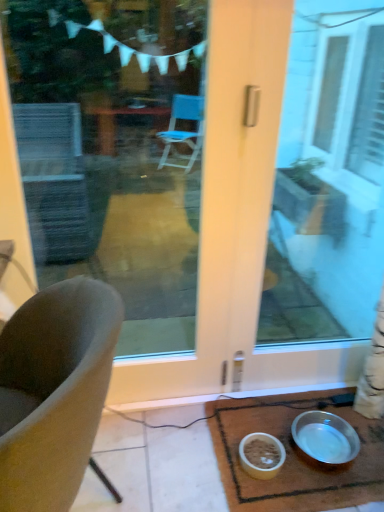
The height and width of the screenshot is (512, 384). What are the coordinates of `metallic silver bowl at lower right` in the screenshot? It's located at (293, 457).

What do you see at coordinates (293, 457) in the screenshot? I see `metallic silver bowl at lower right` at bounding box center [293, 457].

What is the approximate height of transparent glass door at center, positioned as the 2th window screen in right-to-left order?

transparent glass door at center, positioned as the 2th window screen in right-to-left order, is 1.35 meters tall.

Where is `transparent glass door at center, positioned as the 2th window screen in right-to-left order`? This screenshot has height=512, width=384. transparent glass door at center, positioned as the 2th window screen in right-to-left order is located at coordinates (112, 151).

Locate an element on the screen. The width and height of the screenshot is (384, 512). transparent glass door at center, placed as the second window screen when sorted from left to right is located at coordinates (328, 182).

From the image's perspective, is transparent glass door at center, which is the 1th window screen in right-to-left order, over matte brown bowl at lower center, acting as the first bowl starting from the left?

Yes, from the image's perspective, transparent glass door at center, which is the 1th window screen in right-to-left order, is over matte brown bowl at lower center, acting as the first bowl starting from the left.

How many degrees apart are the facing directions of transparent glass door at center, placed as the second window screen when sorted from left to right, and matte brown bowl at lower center, arranged as the second bowl when viewed from the right?

The angular difference between transparent glass door at center, placed as the second window screen when sorted from left to right, and matte brown bowl at lower center, arranged as the second bowl when viewed from the right, is 0.827 degrees.

Between transparent glass door at center, which is the 1th window screen in right-to-left order, and matte brown bowl at lower center, acting as the first bowl starting from the left, which one is positioned behind?

matte brown bowl at lower center, acting as the first bowl starting from the left.

Is transparent glass door at center, placed as the second window screen when sorted from left to right, turned away from matte brown bowl at lower center, acting as the first bowl starting from the left?

That's not correct — transparent glass door at center, placed as the second window screen when sorted from left to right, is not looking away from matte brown bowl at lower center, acting as the first bowl starting from the left.

How many degrees apart are the facing directions of transparent glass door at center, positioned as the 2th window screen in right-to-left order, and matte brown bowl at lower center, acting as the first bowl starting from the left?

0.0906 degrees.

Is transparent glass door at center, positioned as the 2th window screen in right-to-left order, inside or outside of matte brown bowl at lower center, arranged as the second bowl when viewed from the right?

transparent glass door at center, positioned as the 2th window screen in right-to-left order, is not enclosed by matte brown bowl at lower center, arranged as the second bowl when viewed from the right.

From a real-world perspective, is transparent glass door at center, the first window screen positioned from the left, located beneath matte brown bowl at lower center, acting as the first bowl starting from the left?

Result: No, from a real-world perspective, transparent glass door at center, the first window screen positioned from the left, is not under matte brown bowl at lower center, acting as the first bowl starting from the left.

Based on their sizes in the image, would you say soft gray cushion at left is bigger or smaller than silver metallic bowl at lower right, the 2th bowl in the left-to-right sequence?

Clearly, soft gray cushion at left is larger in size than silver metallic bowl at lower right, the 2th bowl in the left-to-right sequence.

Considering their positions, is soft gray cushion at left located in front of or behind silver metallic bowl at lower right, the 2th bowl in the left-to-right sequence?

Visually, soft gray cushion at left is located in front of silver metallic bowl at lower right, the 2th bowl in the left-to-right sequence.

From the image's perspective, which one is positioned lower, soft gray cushion at left or silver metallic bowl at lower right, arranged as the 1th bowl when viewed from the right?

silver metallic bowl at lower right, arranged as the 1th bowl when viewed from the right, appears lower in the image.

From a real-world perspective, who is located higher, soft gray cushion at left or silver metallic bowl at lower right, the 2th bowl in the left-to-right sequence?

soft gray cushion at left is physically above.

Is metallic silver bowl at lower right shorter than soft gray cushion at left?

Correct, metallic silver bowl at lower right is not as tall as soft gray cushion at left.

From the picture: Which object is positioned more to the right, metallic silver bowl at lower right or soft gray cushion at left?

metallic silver bowl at lower right.

Does metallic silver bowl at lower right contain soft gray cushion at left?

No, metallic silver bowl at lower right does not contain soft gray cushion at left.

From a real-world perspective, who is located higher, matte brown bowl at lower center, acting as the first bowl starting from the left, or transparent glass door at center, placed as the second window screen when sorted from left to right?

In real-world perspective, transparent glass door at center, placed as the second window screen when sorted from left to right, is above.

Is matte brown bowl at lower center, acting as the first bowl starting from the left, taller than transparent glass door at center, placed as the second window screen when sorted from left to right?

No, matte brown bowl at lower center, acting as the first bowl starting from the left, is not taller than transparent glass door at center, placed as the second window screen when sorted from left to right.

Is matte brown bowl at lower center, arranged as the second bowl when viewed from the right, facing away from transparent glass door at center, placed as the second window screen when sorted from left to right?

No.

Between point (277, 442) and point (366, 75), which one is positioned in front?

The point (277, 442) is closer.

From the image's perspective, relative to transparent glass door at center, which is the 1th window screen in right-to-left order, is metallic silver bowl at lower right above or below?

Clearly, from the image's perspective, metallic silver bowl at lower right is below transparent glass door at center, which is the 1th window screen in right-to-left order.

Is transparent glass door at center, which is the 1th window screen in right-to-left order, a part of metallic silver bowl at lower right?

No, transparent glass door at center, which is the 1th window screen in right-to-left order, is located outside of metallic silver bowl at lower right.

Where is `window screen that is the 2nd object located above the metallic silver bowl at lower right (from the image's perspective)`? The height and width of the screenshot is (512, 384). window screen that is the 2nd object located above the metallic silver bowl at lower right (from the image's perspective) is located at coordinates click(x=328, y=182).

Which is more distant, (260, 431) or (284, 278)?

The point (284, 278) is behind.

Could you tell me if silver metallic bowl at lower right, the 2th bowl in the left-to-right sequence, is facing soft gray cushion at left?

No, silver metallic bowl at lower right, the 2th bowl in the left-to-right sequence, is not facing towards soft gray cushion at left.

From the image's perspective, which is above, silver metallic bowl at lower right, the 2th bowl in the left-to-right sequence, or soft gray cushion at left?

soft gray cushion at left.

Is silver metallic bowl at lower right, the 2th bowl in the left-to-right sequence, spatially inside soft gray cushion at left, or outside of it?

silver metallic bowl at lower right, the 2th bowl in the left-to-right sequence, cannot be found inside soft gray cushion at left.

Is silver metallic bowl at lower right, the 2th bowl in the left-to-right sequence, taller than soft gray cushion at left?

Incorrect, the height of silver metallic bowl at lower right, the 2th bowl in the left-to-right sequence, is not larger of that of soft gray cushion at left.

The image size is (384, 512). In order to click on window screen on the right of matte brown bowl at lower center, arranged as the second bowl when viewed from the right in this screenshot , I will do `click(328, 182)`.

The width and height of the screenshot is (384, 512). Identify the location of the 2nd bowl below the transparent glass door at center, the first window screen positioned from the left (from a real-world perspective). (261, 455).

Based on their spatial positions, is silver metallic bowl at lower right, the 2th bowl in the left-to-right sequence, or transparent glass door at center, which is the 1th window screen in right-to-left order, closer to soft gray cushion at left?

Among the two, silver metallic bowl at lower right, the 2th bowl in the left-to-right sequence, is located nearer to soft gray cushion at left.

Looking at the image, which one is located further to soft gray cushion at left, silver metallic bowl at lower right, arranged as the 1th bowl when viewed from the right, or matte brown bowl at lower center, arranged as the second bowl when viewed from the right?

The object further to soft gray cushion at left is silver metallic bowl at lower right, arranged as the 1th bowl when viewed from the right.

Considering their positions, is metallic silver bowl at lower right positioned further to soft gray cushion at left than transparent glass door at center, which is the 1th window screen in right-to-left order?

Based on the image, transparent glass door at center, which is the 1th window screen in right-to-left order, appears to be further to soft gray cushion at left.

Considering their positions, is transparent glass door at center, positioned as the 2th window screen in right-to-left order, positioned closer to soft gray cushion at left than transparent glass door at center, placed as the second window screen when sorted from left to right?

Among the two, transparent glass door at center, placed as the second window screen when sorted from left to right, is located nearer to soft gray cushion at left.

Looking at the image, which one is located further to matte brown bowl at lower center, arranged as the second bowl when viewed from the right, transparent glass door at center, positioned as the 2th window screen in right-to-left order, or transparent glass door at center, placed as the second window screen when sorted from left to right?

transparent glass door at center, positioned as the 2th window screen in right-to-left order.

From the picture: Which object lies further to the anchor point transparent glass door at center, the first window screen positioned from the left, silver metallic bowl at lower right, the 2th bowl in the left-to-right sequence, or matte brown bowl at lower center, arranged as the second bowl when viewed from the right?

matte brown bowl at lower center, arranged as the second bowl when viewed from the right.

Based on their spatial positions, is transparent glass door at center, the first window screen positioned from the left, or silver metallic bowl at lower right, arranged as the 1th bowl when viewed from the right, further from soft gray cushion at left?

transparent glass door at center, the first window screen positioned from the left, is further to soft gray cushion at left.

Estimate the real-world distances between objects in this image. Which object is further from transparent glass door at center, the first window screen positioned from the left, silver metallic bowl at lower right, the 2th bowl in the left-to-right sequence, or metallic silver bowl at lower right?

Based on the image, silver metallic bowl at lower right, the 2th bowl in the left-to-right sequence, appears to be further to transparent glass door at center, the first window screen positioned from the left.

Find the location of `bowl between transparent glass door at center, which is the 1th window screen in right-to-left order, and matte brown bowl at lower center, acting as the first bowl starting from the left, in the vertical direction`. bowl between transparent glass door at center, which is the 1th window screen in right-to-left order, and matte brown bowl at lower center, acting as the first bowl starting from the left, in the vertical direction is located at coordinates (325, 438).

This screenshot has width=384, height=512. I want to click on table situated between matte brown bowl at lower center, acting as the first bowl starting from the left, and silver metallic bowl at lower right, arranged as the 1th bowl when viewed from the right, from left to right, so click(293, 457).

Locate an element on the screen. This screenshot has width=384, height=512. window screen between transparent glass door at center, which is the 1th window screen in right-to-left order, and metallic silver bowl at lower right, in the vertical direction is located at coordinates (112, 151).

Identify the location of window screen between soft gray cushion at left and transparent glass door at center, placed as the second window screen when sorted from left to right, in the horizontal direction. The image size is (384, 512). (112, 151).